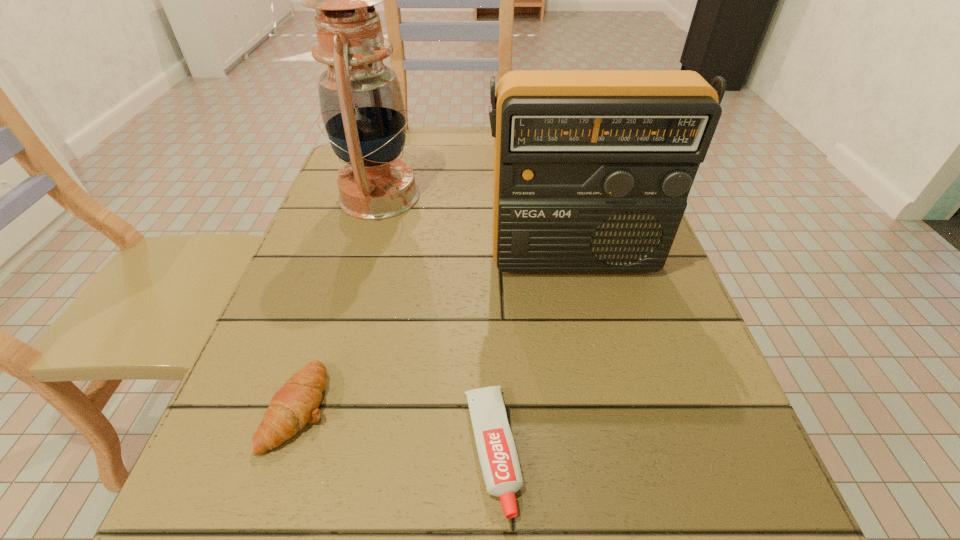
This screenshot has width=960, height=540. I want to click on the farthest object, so click(362, 107).

The width and height of the screenshot is (960, 540). Identify the location of oil lamp. (362, 107).

Where is `the third shortest object`? the third shortest object is located at coordinates (592, 168).

Where is `radio receiver`? radio receiver is located at coordinates (592, 168).

Locate an element on the screen. The height and width of the screenshot is (540, 960). the third tallest object is located at coordinates (296, 403).

You are a GUI agent. You are given a task and a screenshot of the screen. Output one action in this format:
    pyautogui.click(x=<x>, y=<y>)
    Task: Click on the toothpaste
    
    Given the screenshot: What is the action you would take?
    point(496,449)

At what (x,y) coordinates should I click in order to perform the action: click on free space located on the right of the oil lamp. Please return your answer as a coordinate pair (x, y). The width and height of the screenshot is (960, 540). Looking at the image, I should click on tap(560, 196).

I want to click on vacant area situated 0.200m on the front-facing side of the third shortest object, so click(x=599, y=372).

The image size is (960, 540). Identify the location of vacant space located on the right of the crescent roll. (398, 407).

Identify the location of blank area located on the right of the shortest object. The height and width of the screenshot is (540, 960). point(588,451).